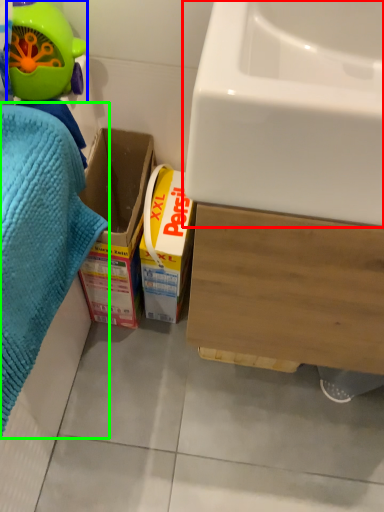
Question: Which is nearer to the sink (highlighted by a red box)? toy (highlighted by a blue box) or bath towel (highlighted by a green box).

Choices:
 (A) toy
 (B) bath towel

Answer: (B)